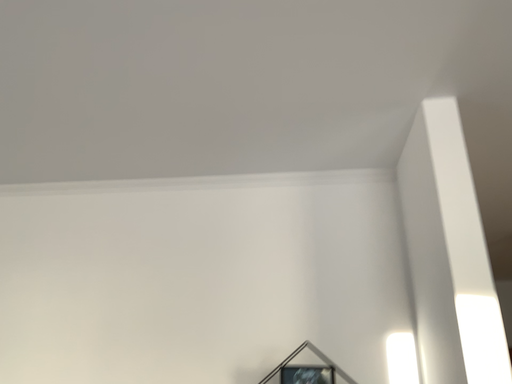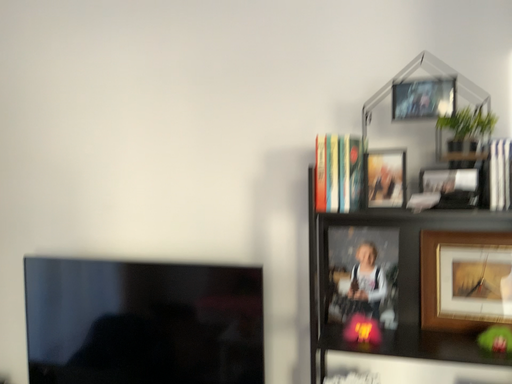
Question: Which way did the camera rotate in the video?

Choices:
 (A) rotated right
 (B) rotated left

Answer: (B)